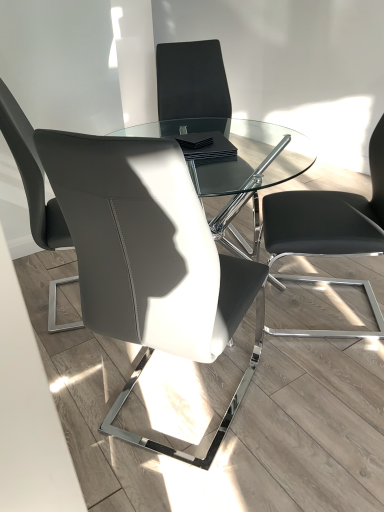
Question: From the image's perspective, is matte gray leather chair at left, placed as the 4th chair when sorted from right to left, located above or below matte black chair at center, acting as the 3th chair starting from the left?

Choices:
 (A) below
 (B) above

Answer: (A)

Question: Considering the relative positions of matte gray leather chair at left, the 1th chair in the left-to-right sequence, and matte black chair at center, which is the 2th chair from right to left, in the image provided, is matte gray leather chair at left, the 1th chair in the left-to-right sequence, to the left or to the right of matte black chair at center, which is the 2th chair from right to left,?

Choices:
 (A) right
 (B) left

Answer: (B)

Question: Which of these objects is positioned farthest from the matte black chair at center, which is the 3th chair from right to left?

Choices:
 (A) matte gray leather chair at left, the 1th chair in the left-to-right sequence
 (B) matte black chair at center, acting as the 3th chair starting from the left
 (C) black leather chair at right, arranged as the fourth chair when viewed from the left

Answer: (B)

Question: Which of these objects is positioned farthest from the matte black chair at center, which is the 3th chair from right to left?

Choices:
 (A) matte gray leather chair at left, the 1th chair in the left-to-right sequence
 (B) black leather chair at right, arranged as the fourth chair when viewed from the left
 (C) matte black chair at center, which is the 2th chair from right to left

Answer: (C)